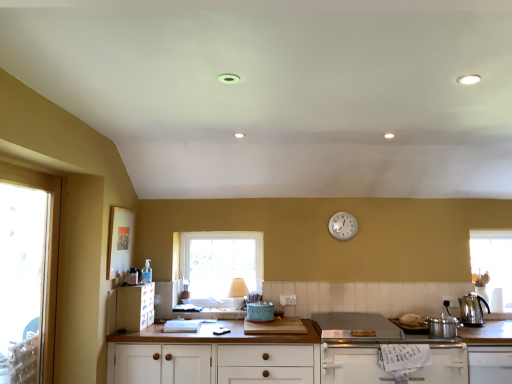
Question: Would you say stainless steel kettle at right is to the left or to the right of white matte cabinet at lower right, placed as the third cabinetry when sorted from left to right, in the picture?

Choices:
 (A) right
 (B) left

Answer: (A)

Question: Is stainless steel kettle at right in front of or behind white matte cabinet at lower right, which is counted as the second cabinetry, starting from the right, in the image?

Choices:
 (A) behind
 (B) front

Answer: (A)

Question: Which of these objects is positioned farthest from the clear glass window at center, which is the 2th window from front to back?

Choices:
 (A) silver metallic pot at lower right, the 4th cabinetry in the left-to-right sequence
 (B) stainless steel cooktop at lower center
 (C) teal ceramic toaster at center, the 2th appliance in the right-to-left sequence
 (D) transparent glass window at left, the 1th window when ordered from left to right
 (E) matte plastic cabinet at lower left, the first cabinetry positioned from the left

Answer: (A)

Question: Which is farther from the clear glass window at center, the first window from the right?

Choices:
 (A) white matte cabinet at lower right, placed as the third cabinetry when sorted from left to right
 (B) teal ceramic toaster at center, the 2th appliance in the right-to-left sequence
 (C) transparent glass window at left, arranged as the 2th window when viewed from the right
 (D) white wood cabinet at center, the second cabinetry from the left
 (E) metallic silver pot at right, placed as the 1th appliance when sorted from right to left

Answer: (E)